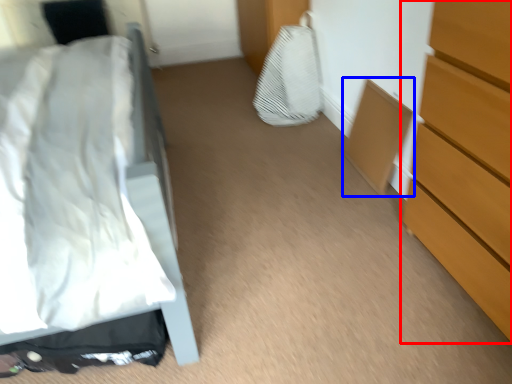
Question: Among these objects, which one is farthest to the camera, chest of drawers (highlighted by a red box) or cabinetry (highlighted by a blue box)?

Choices:
 (A) chest of drawers
 (B) cabinetry

Answer: (B)